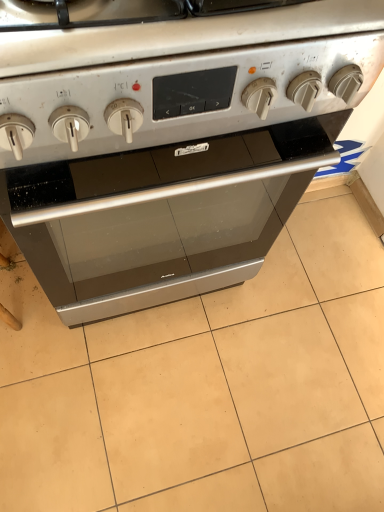
Locate an element on the screen. This screenshot has width=384, height=512. free space above matte silver oven at center (from a real-world perspective) is located at coordinates (221, 376).